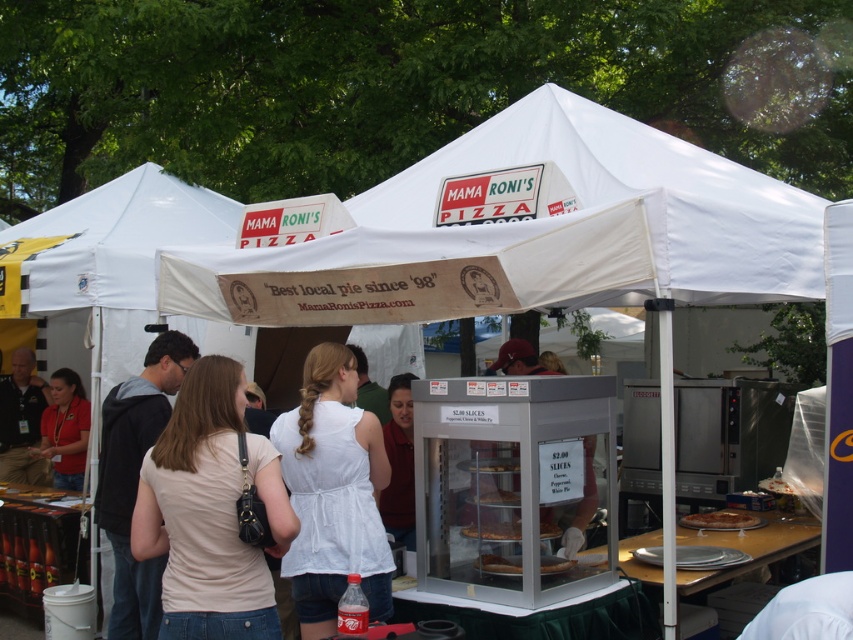
Question: Is white fabric tent at center further to camera compared to light beige t-shirt at center?

Choices:
 (A) no
 (B) yes

Answer: (B)

Question: Which point appears closest to the camera in this image?

Choices:
 (A) (206, 472)
 (B) (79, 451)
 (C) (625, 385)

Answer: (A)

Question: Is white fabric tent at center positioned behind matte red shirt at lower left?

Choices:
 (A) yes
 (B) no

Answer: (B)

Question: Which point is farther from the camera taking this photo?

Choices:
 (A) (633, 451)
 (B) (305, 380)
 (C) (50, 458)

Answer: (C)

Question: Is white fabric tent at center closer to the viewer compared to matte red shirt at lower left?

Choices:
 (A) no
 (B) yes

Answer: (B)

Question: Which of the following is the closest to the observer?

Choices:
 (A) golden crispy pizza at center
 (B) golden brown crusty pizza at center
 (C) light beige t-shirt at center

Answer: (C)